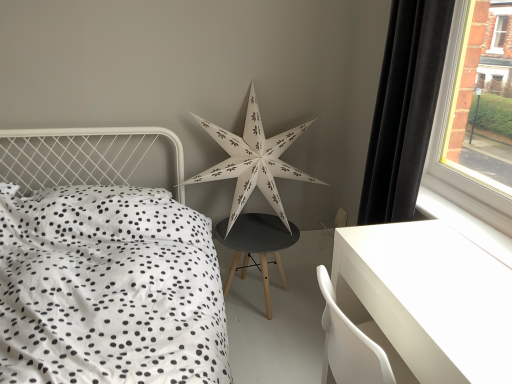
Question: Can you confirm if white paper star at center is bigger than white dotted fabric at left?

Choices:
 (A) yes
 (B) no

Answer: (B)

Question: Does white paper star at center come behind white dotted fabric at left?

Choices:
 (A) no
 (B) yes

Answer: (B)

Question: From a real-world perspective, is white paper star at center over white dotted fabric at left?

Choices:
 (A) yes
 (B) no

Answer: (A)

Question: Is white paper star at center in front of white dotted fabric at left?

Choices:
 (A) no
 (B) yes

Answer: (A)

Question: Does white paper star at center have a greater height compared to white dotted fabric at left?

Choices:
 (A) yes
 (B) no

Answer: (A)

Question: Considering the positions of white glossy table at lower right and black velvet curtain at right in the image, is white glossy table at lower right taller or shorter than black velvet curtain at right?

Choices:
 (A) short
 (B) tall

Answer: (A)

Question: Is white glossy table at lower right to the left or to the right of black velvet curtain at right in the image?

Choices:
 (A) left
 (B) right

Answer: (A)

Question: From a real-world perspective, is white glossy table at lower right above or below black velvet curtain at right?

Choices:
 (A) above
 (B) below

Answer: (B)

Question: Is white glossy table at lower right bigger or smaller than black velvet curtain at right?

Choices:
 (A) small
 (B) big

Answer: (B)

Question: From a real-world perspective, is white smooth window sill at lower right physically located above or below white glossy table at lower right?

Choices:
 (A) below
 (B) above

Answer: (B)

Question: From the image's perspective, is white smooth window sill at lower right positioned above or below white glossy table at lower right?

Choices:
 (A) above
 (B) below

Answer: (A)

Question: Considering the positions of white smooth window sill at lower right and white glossy table at lower right in the image, is white smooth window sill at lower right wider or thinner than white glossy table at lower right?

Choices:
 (A) wide
 (B) thin

Answer: (B)

Question: Is white smooth window sill at lower right in front of or behind white glossy table at lower right in the image?

Choices:
 (A) front
 (B) behind

Answer: (B)

Question: From the image's perspective, relative to white paper star at center, is black velvet curtain at right above or below?

Choices:
 (A) below
 (B) above

Answer: (B)

Question: Is black velvet curtain at right taller or shorter than white paper star at center?

Choices:
 (A) short
 (B) tall

Answer: (B)